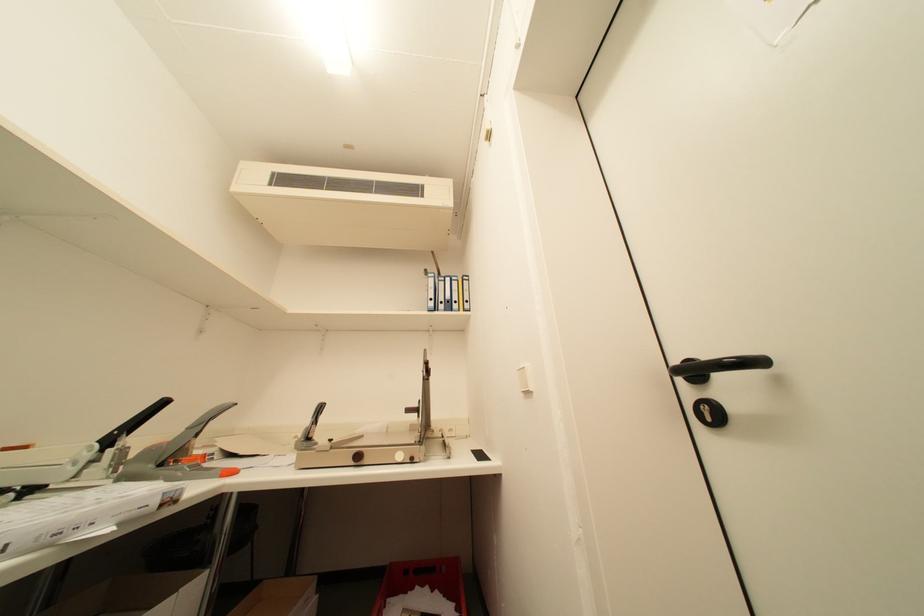
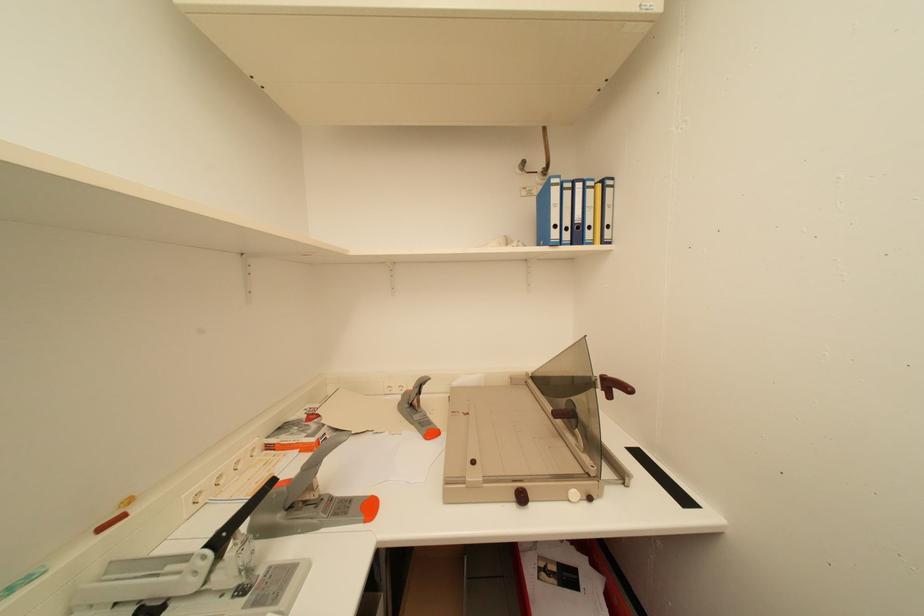
Question: The first image is from the beginning of the video and the second image is from the end. How did the camera likely rotate when shooting the video?

Choices:
 (A) Left
 (B) Right
 (C) Up
 (D) Down

Answer: (D)